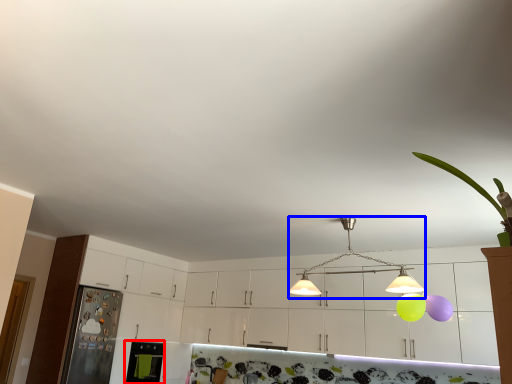
Question: Which object is closer to the camera taking this photo, appliance (highlighted by a red box) or light (highlighted by a blue box)?

Choices:
 (A) appliance
 (B) light

Answer: (B)